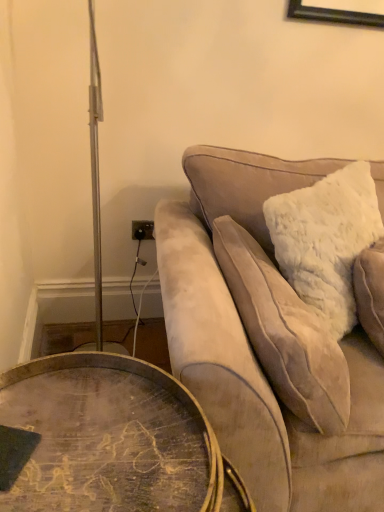
Question: In terms of width, does velvet beige couch at upper right look wider or thinner when compared to white fluffy pillow at right?

Choices:
 (A) thin
 (B) wide

Answer: (B)

Question: Considering the positions of point (249, 195) and point (238, 253), is point (249, 195) closer or farther from the camera than point (238, 253)?

Choices:
 (A) farther
 (B) closer

Answer: (A)

Question: Estimate the real-world distances between objects in this image. Which object is farther from the velvet beige couch at upper right?

Choices:
 (A) wooden round table at lower left
 (B) white fluffy pillow at right

Answer: (A)

Question: Estimate the real-world distances between objects in this image. Which object is farther from the velvet beige couch at upper right?

Choices:
 (A) wooden round table at lower left
 (B) white fluffy pillow at right

Answer: (A)